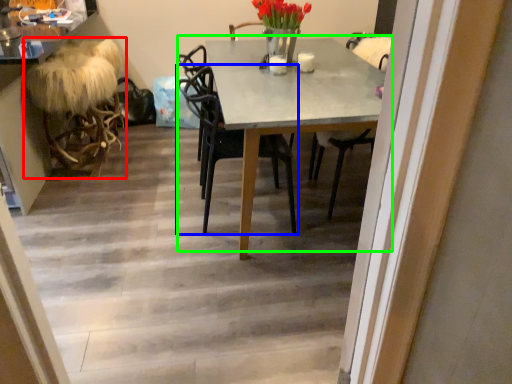
Question: Based on their relative distances, which object is nearer to rocking chair (highlighted by a red box)? Choose from chair (highlighted by a blue box) and kitchen & dining room table (highlighted by a green box).

Choices:
 (A) chair
 (B) kitchen & dining room table

Answer: (A)